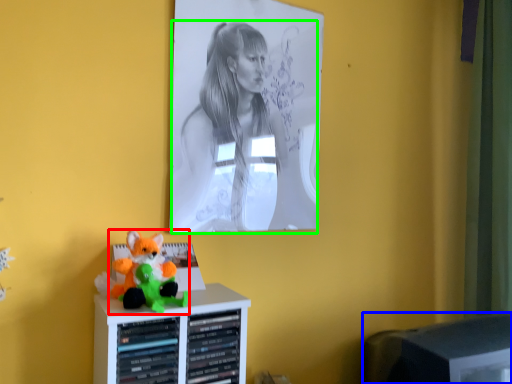
Question: Which is farther away from toy (highlighted by a red box)? computer monitor (highlighted by a blue box) or person (highlighted by a green box)?

Choices:
 (A) computer monitor
 (B) person

Answer: (A)